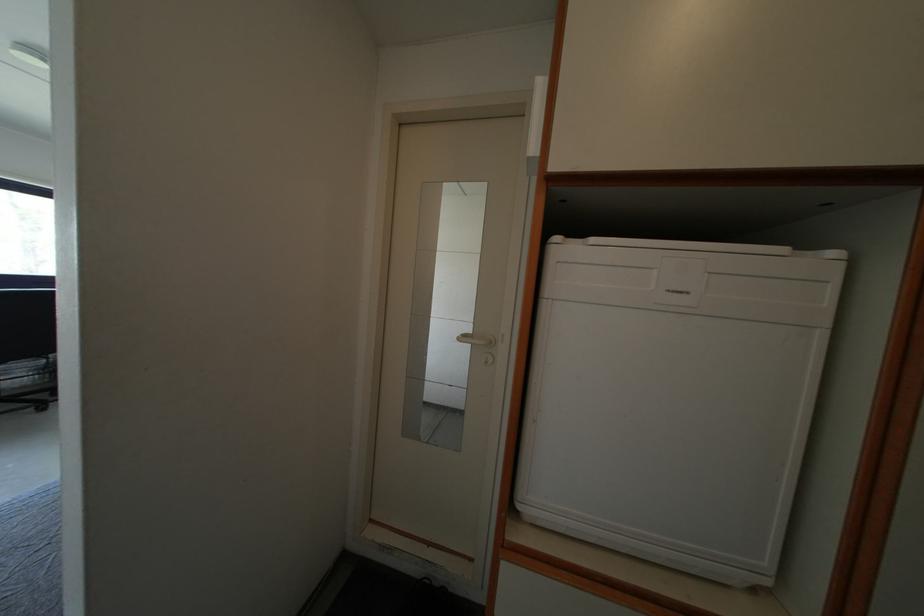
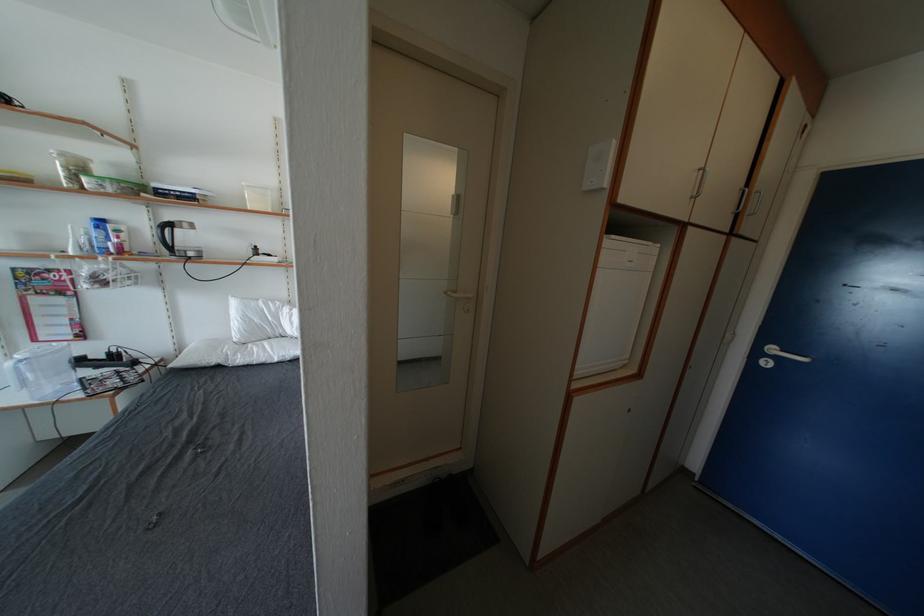
Question: The first image is from the beginning of the video and the second image is from the end. How did the camera likely rotate when shooting the video?

Choices:
 (A) Left
 (B) Right
 (C) Up
 (D) Down

Answer: (B)